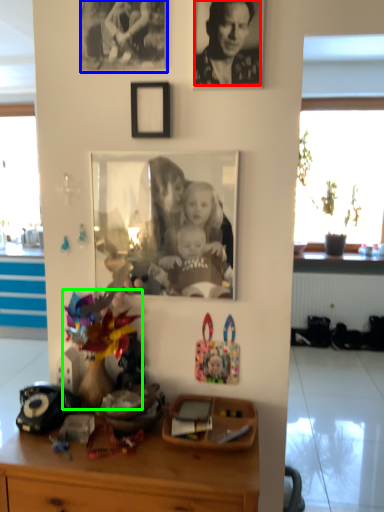
Question: Considering the real-world distances, which object is closest to person (highlighted by a red box)? picture frame (highlighted by a blue box) or toy (highlighted by a green box).

Choices:
 (A) picture frame
 (B) toy

Answer: (A)